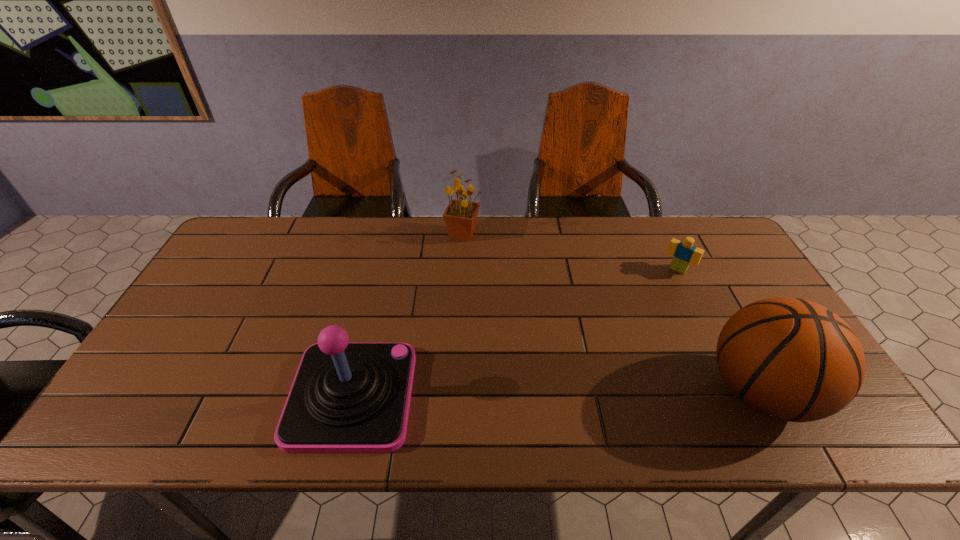
The width and height of the screenshot is (960, 540). In the image, there is a desktop. In order to click on vacant space at the far edge in this screenshot , I will do `click(583, 225)`.

Locate an element on the screen. free region at the near edge of the desktop is located at coordinates 640,394.

Identify the location of vacant space at the left edge of the desktop. (214, 354).

You are a GUI agent. You are given a task and a screenshot of the screen. Output one action in this format:
    pyautogui.click(x=<x>, y=<y>)
    Task: Click on the vacant region at the right edge
    The image size is (960, 540).
    Given the screenshot: What is the action you would take?
    pyautogui.click(x=735, y=309)

The width and height of the screenshot is (960, 540). What are the coordinates of `vacant space at the far left corner` in the screenshot? It's located at point(244,242).

The width and height of the screenshot is (960, 540). What are the coordinates of `free region at the near left corner of the desktop` in the screenshot? It's located at (123, 399).

Identify the location of vacant space at the far right corner of the desktop. The image size is (960, 540). (717, 242).

The image size is (960, 540). In order to click on vacant region between the joystick and the basketball in this screenshot , I will do (557, 394).

I want to click on empty space that is in between the third object from right to left and the basketball, so click(612, 312).

Find the location of a particular element. The width and height of the screenshot is (960, 540). empty space between the joystick and the basketball is located at coordinates (557, 394).